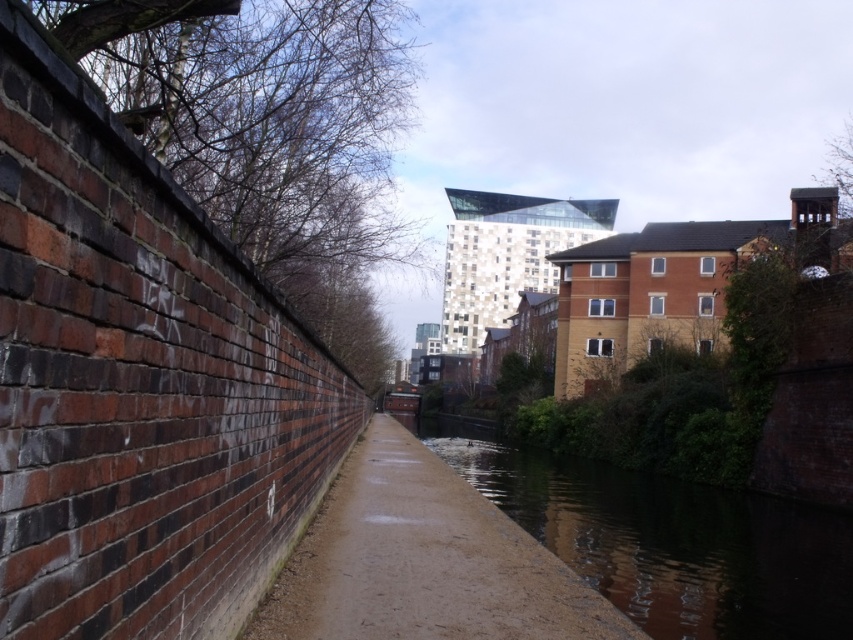
Question: Does dark reflective water at center appear over sandy concrete path at center?

Choices:
 (A) no
 (B) yes

Answer: (A)

Question: Among these points, which one is farthest from the camera?

Choices:
 (A) (550, 564)
 (B) (650, 486)

Answer: (B)

Question: Is dark reflective water at center above sandy concrete path at center?

Choices:
 (A) no
 (B) yes

Answer: (A)

Question: Among these objects, which one is farthest from the camera?

Choices:
 (A) dark reflective water at center
 (B) sandy concrete path at center

Answer: (A)

Question: Which of the following is the farthest from the observer?

Choices:
 (A) sandy concrete path at center
 (B) dark reflective water at center

Answer: (B)

Question: Is dark reflective water at center behind sandy concrete path at center?

Choices:
 (A) yes
 (B) no

Answer: (A)